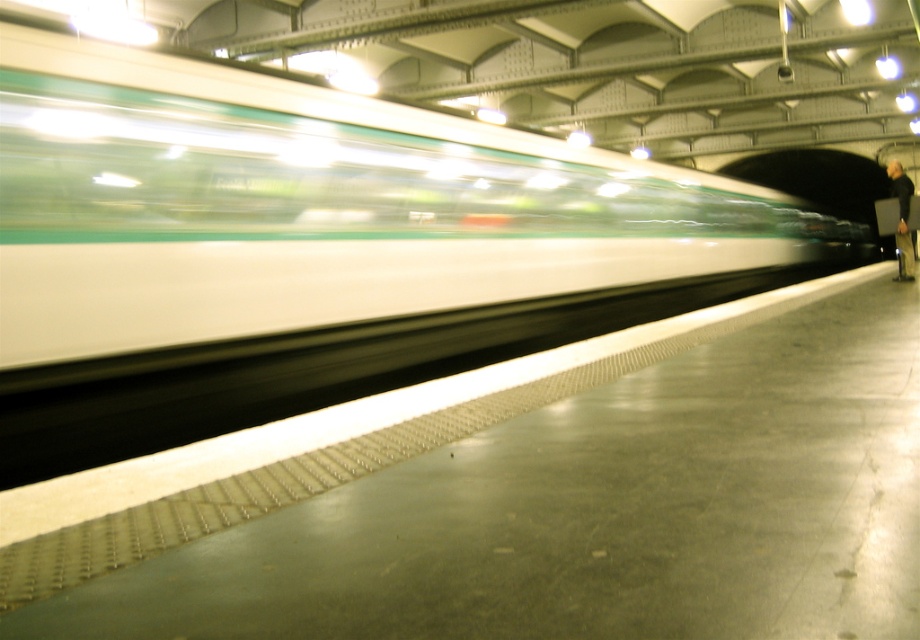
You are a passenger waiting on the platform and see the white glossy train at center and the dark gray jacket at right. Which object is narrower?

The white glossy train at center is narrower than the dark gray jacket at right.

You are a photographer standing on the platform and want to capture both the white glossy train at center and the dark gray jacket at right in a single shot. Considering their sizes in the image, which object should you focus on first to ensure both are in sharp focus?

The white glossy train at center is smaller than the dark gray jacket at right, so you should focus on the dark gray jacket at right first since it is closer to you, ensuring both objects will be in focus when using a shallow depth of field.

You are a maintenance worker at the train station. You need to place a 10 meter long safety barrier between the white glossy train at center and the dark gray jacket at right. Is there enough space between them to fit the barrier?

The white glossy train at center is 8.78 meters from the dark gray jacket at right. Since the safety barrier is 10 meters long, which is longer than the distance between them, it cannot be placed between them.